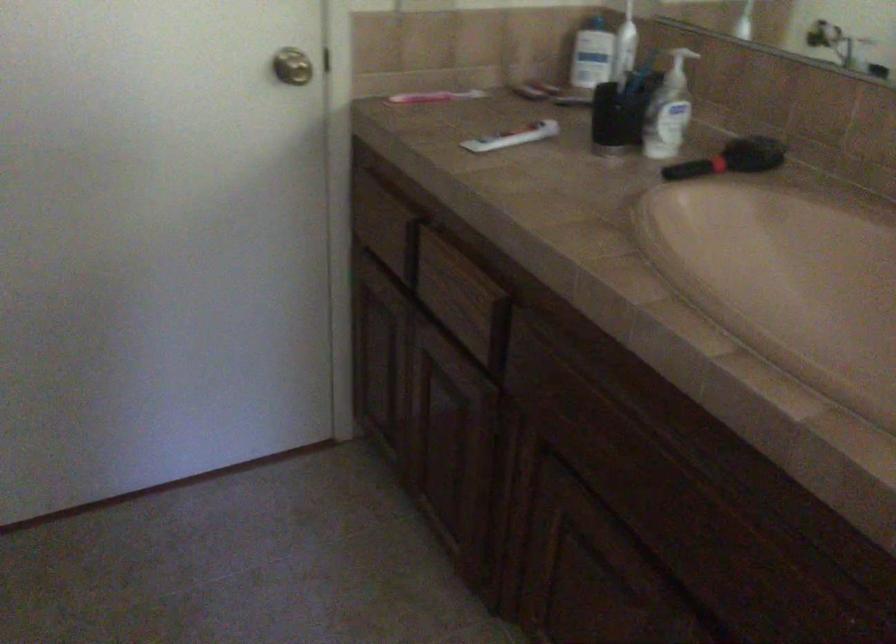
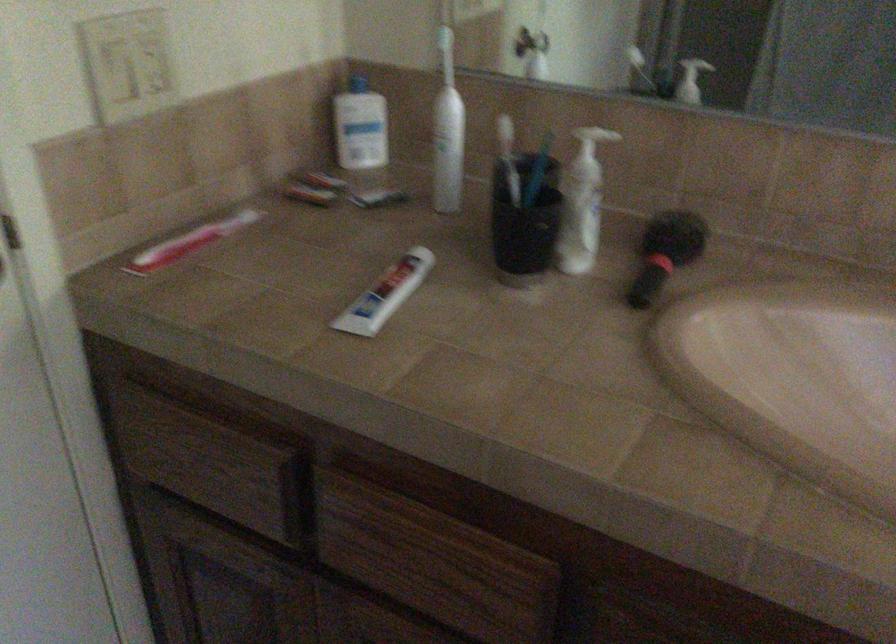
In the second image, find the point that corresponds to point (722, 158) in the first image.

(666, 252)